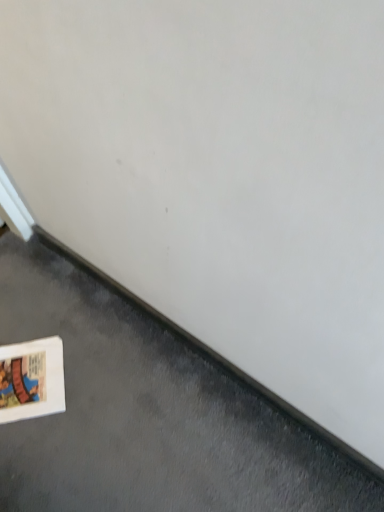
Question: Does white matte book at lower left appear on the right side of white cardboard at lower left?

Choices:
 (A) yes
 (B) no

Answer: (A)

Question: Is white matte book at lower left closer to the viewer compared to white cardboard at lower left?

Choices:
 (A) no
 (B) yes

Answer: (B)

Question: Considering the relative sizes of white matte book at lower left and white cardboard at lower left in the image provided, is white matte book at lower left wider than white cardboard at lower left?

Choices:
 (A) no
 (B) yes

Answer: (B)

Question: Would you say white matte book at lower left is a long distance from white cardboard at lower left?

Choices:
 (A) no
 (B) yes

Answer: (A)

Question: From the image's perspective, is white matte book at lower left over white cardboard at lower left?

Choices:
 (A) no
 (B) yes

Answer: (A)

Question: Does white matte book at lower left have a greater height compared to white cardboard at lower left?

Choices:
 (A) yes
 (B) no

Answer: (A)

Question: Can you confirm if white cardboard at lower left is thinner than white matte book at lower left?

Choices:
 (A) no
 (B) yes

Answer: (B)

Question: Is white cardboard at lower left in contact with white matte book at lower left?

Choices:
 (A) yes
 (B) no

Answer: (B)

Question: From the image's perspective, does white cardboard at lower left appear higher than white matte book at lower left?

Choices:
 (A) yes
 (B) no

Answer: (A)

Question: Is white cardboard at lower left looking in the opposite direction of white matte book at lower left?

Choices:
 (A) no
 (B) yes

Answer: (B)

Question: Considering the relative sizes of white cardboard at lower left and white matte book at lower left in the image provided, is white cardboard at lower left wider than white matte book at lower left?

Choices:
 (A) no
 (B) yes

Answer: (A)

Question: From a real-world perspective, is white cardboard at lower left located higher than white matte book at lower left?

Choices:
 (A) yes
 (B) no

Answer: (B)

Question: From a real-world perspective, is white cardboard at lower left positioned above or below white matte book at lower left?

Choices:
 (A) below
 (B) above

Answer: (A)